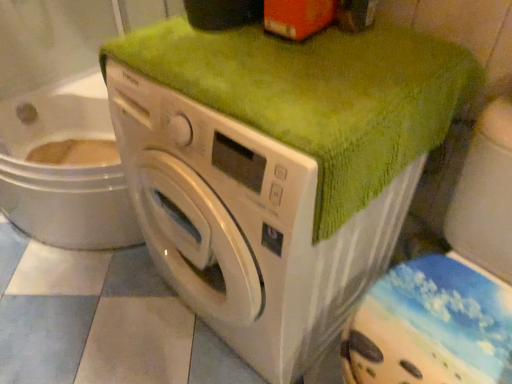
I want to click on white glossy washing machine at center, so click(x=246, y=225).

The height and width of the screenshot is (384, 512). I want to click on green fabric-covered washer at right, so click(450, 283).

From their relative heights in the image, would you say white glossy washing machine at center is taller or shorter than green textured towel at upper center?

In the image, white glossy washing machine at center appears to be taller than green textured towel at upper center.

Identify the location of washing machine that is below the green textured towel at upper center (from the image's perspective). (246, 225).

Based on the photo, which is closer, (131, 150) or (423, 78)?

The point (423, 78) is more forward.

Is white glossy washing machine at center inside or outside of green textured towel at upper center?

white glossy washing machine at center is located beyond the bounds of green textured towel at upper center.

Is white glossy washing machine at center not near green fabric-covered washer at right?

white glossy washing machine at center is actually quite close to green fabric-covered washer at right.

Is point (335, 251) closer or farther from the camera than point (428, 342)?

Point (335, 251) appears to be farther away from the viewer than point (428, 342).

Visually, is white glossy washing machine at center positioned to the left or to the right of green fabric-covered washer at right?

From the image, it's evident that white glossy washing machine at center is to the left of green fabric-covered washer at right.

Which of these two, white glossy washing machine at center or green fabric-covered washer at right, is smaller?

green fabric-covered washer at right.

Would you say green textured towel at upper center is outside green fabric-covered washer at right?

Yes, green textured towel at upper center is outside of green fabric-covered washer at right.

Is green textured towel at upper center positioned with its back to green fabric-covered washer at right?

green textured towel at upper center is not turned away from green fabric-covered washer at right.

Considering the sizes of objects green textured towel at upper center and green fabric-covered washer at right in the image provided, who is smaller, green textured towel at upper center or green fabric-covered washer at right?

green textured towel at upper center is smaller.

From a real-world perspective, which is physically below, green fabric-covered washer at right or green textured towel at upper center?

In real-world perspective, green fabric-covered washer at right is lower.

Looking at this image, are green fabric-covered washer at right and green textured towel at upper center located far from each other?

No, there isn't a large distance between green fabric-covered washer at right and green textured towel at upper center.

Consider the image. Measure the distance from green fabric-covered washer at right to green textured towel at upper center.

green fabric-covered washer at right is 12.78 inches from green textured towel at upper center.

Is green fabric-covered washer at right oriented towards green textured towel at upper center?

No, green fabric-covered washer at right is not oriented towards green textured towel at upper center.

Does green textured towel at upper center touch white glossy washing machine at center?

green textured towel at upper center and white glossy washing machine at center are clearly separated.

From the image's perspective, would you say green textured towel at upper center is positioned over white glossy washing machine at center?

Yes.

Which is more to the right, green textured towel at upper center or white glossy washing machine at center?

green textured towel at upper center is more to the right.

From a real-world perspective, is green textured towel at upper center positioned above or below white glossy washing machine at center?

Clearly, from a real-world perspective, green textured towel at upper center is above white glossy washing machine at center.

From the image's perspective, relative to white glossy washing machine at center, is green fabric-covered washer at right above or below?

green fabric-covered washer at right is below white glossy washing machine at center.

Would you say green fabric-covered washer at right is inside or outside white glossy washing machine at center?

green fabric-covered washer at right is not enclosed by white glossy washing machine at center.

Is green fabric-covered washer at right looking in the opposite direction of white glossy washing machine at center?

green fabric-covered washer at right does not have its back to white glossy washing machine at center.

You are a GUI agent. You are given a task and a screenshot of the screen. Output one action in this format:
    pyautogui.click(x=<x>, y=<y>)
    Task: Click on the bath towel above the white glossy washing machine at center (from the image's perspective)
    This screenshot has width=512, height=384.
    Given the screenshot: What is the action you would take?
    pyautogui.click(x=318, y=96)

Find the location of `washer in front of the white glossy washing machine at center`. washer in front of the white glossy washing machine at center is located at coordinates (450, 283).

Looking at the image, which one is located further to green fabric-covered washer at right, white glossy washing machine at center or green textured towel at upper center?

green textured towel at upper center.

Looking at the image, which one is located further to white glossy washing machine at center, green textured towel at upper center or green fabric-covered washer at right?

Based on the image, green fabric-covered washer at right appears to be further to white glossy washing machine at center.

When comparing their distances from green fabric-covered washer at right, does green textured towel at upper center or white glossy washing machine at center seem closer?

Based on the image, white glossy washing machine at center appears to be nearer to green fabric-covered washer at right.

Considering their positions, is green fabric-covered washer at right positioned further to green textured towel at upper center than white glossy washing machine at center?

green fabric-covered washer at right is further to green textured towel at upper center.

Estimate the real-world distances between objects in this image. Which object is closer to green textured towel at upper center, white glossy washing machine at center or green fabric-covered washer at right?

Based on the image, white glossy washing machine at center appears to be nearer to green textured towel at upper center.

Based on their spatial positions, is green fabric-covered washer at right or green textured towel at upper center closer to white glossy washing machine at center?

The object closer to white glossy washing machine at center is green textured towel at upper center.

You are a GUI agent. You are given a task and a screenshot of the screen. Output one action in this format:
    pyautogui.click(x=<x>, y=<y>)
    Task: Click on the washing machine between green textured towel at upper center and green fabric-covered washer at right from top to bottom
    Image resolution: width=512 pixels, height=384 pixels.
    Given the screenshot: What is the action you would take?
    pyautogui.click(x=246, y=225)